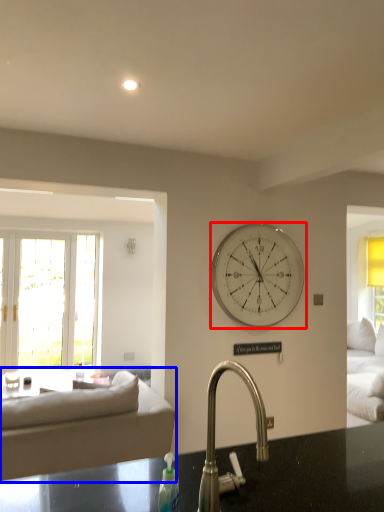
Question: Which of the following is the closest to the observer, wall clock (highlighted by a red box) or studio couch (highlighted by a blue box)?

Choices:
 (A) wall clock
 (B) studio couch

Answer: (B)